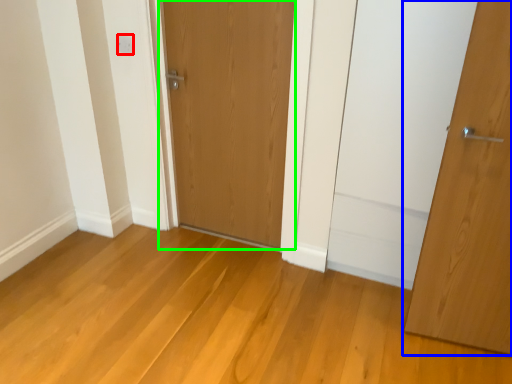
Question: Which is nearer to the electric outlet (highlighted by a red box)? door (highlighted by a blue box) or door (highlighted by a green box).

Choices:
 (A) door
 (B) door

Answer: (B)